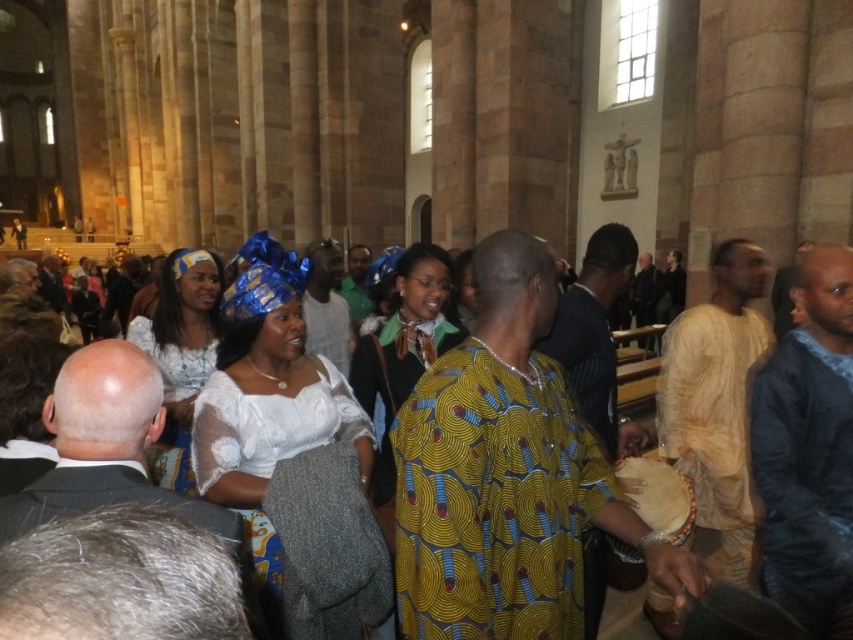
You are a photographer standing at the back of the cathedral and want to take a photo of both the matte blue fabric headwrap at center and the yellow printed dress at center. The camera you are using has a maximum focus range of 4 meters. Can you capture both subjects in focus without moving closer?

The distance between the matte blue fabric headwrap at center and the yellow printed dress at center is 4.30 meters. Since the camera can only focus up to 4 meters, the subjects are slightly out of the focus range. Therefore, you would need to move closer to ensure both are in focus.

You are a photographer standing at the back of the cathedral and want to take a photo of both the yellow printed fabric dress at center and the white lace dress at center. The camera you are using has a maximum focus range of 10 meters. Can you capture both subjects in focus without moving closer?

The distance between the yellow printed fabric dress at center and the white lace dress at center is 12.59 meters, which exceeds the camera maximum focus range of 10 meters. Therefore, you cannot capture both subjects in focus without moving closer.